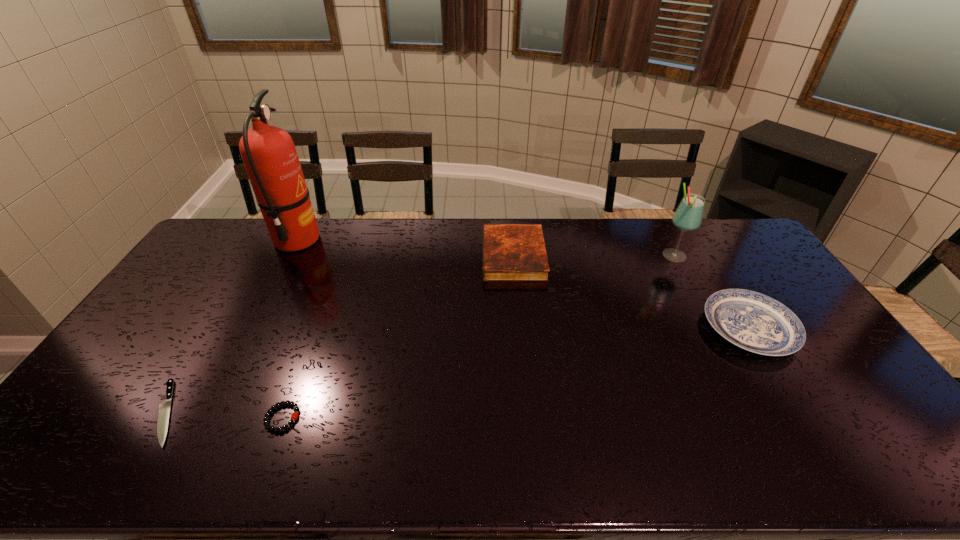
Image resolution: width=960 pixels, height=540 pixels. I want to click on free space located on the spine side of the fourth object from left to right, so click(x=402, y=256).

Image resolution: width=960 pixels, height=540 pixels. What are the coordinates of `vacant space situated on the spine side of the fourth object from left to right` in the screenshot? It's located at (455, 256).

You are a GUI agent. You are given a task and a screenshot of the screen. Output one action in this format:
    pyautogui.click(x=<x>, y=<y>)
    Task: Click on the free space located 0.200m on the left of the plate
    
    Given the screenshot: What is the action you would take?
    click(x=637, y=328)

At what (x,y) coordinates should I click in order to perform the action: click on vacant region located on the right of the bracelet. Please return your answer as a coordinate pair (x, y). This screenshot has height=540, width=960. Looking at the image, I should click on tap(330, 417).

At what (x,y) coordinates should I click in order to perform the action: click on free space located 0.190m on the right of the steak knife. Please return your answer as a coordinate pair (x, y). This screenshot has width=960, height=540. Looking at the image, I should click on (259, 413).

The height and width of the screenshot is (540, 960). I want to click on fire extinguisher that is at the far edge, so click(269, 155).

This screenshot has width=960, height=540. I want to click on alcohol situated at the far edge, so click(x=688, y=216).

At what (x,y) coordinates should I click in order to perform the action: click on Bible positioned at the far edge. Please return your answer as a coordinate pair (x, y). Looking at the image, I should click on (511, 252).

Find the location of a particular element. The width and height of the screenshot is (960, 540). object located in the near edge section of the desktop is located at coordinates (164, 408).

The image size is (960, 540). Find the location of `object that is at the right edge`. object that is at the right edge is located at coordinates (755, 322).